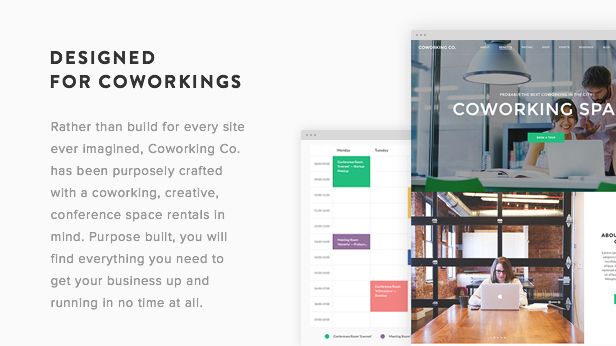
I want to click on lights, so click(496, 67), click(524, 212), click(533, 200), click(511, 195), click(452, 201).